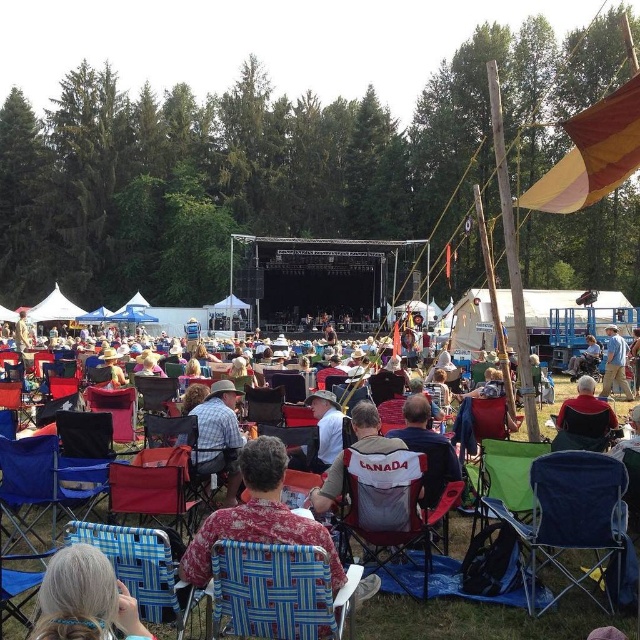
Based on the photo, does blue woven fabric chair at lower center come behind red fabric chair at center?

No, blue woven fabric chair at lower center is closer to the viewer.

Can you confirm if blue woven fabric chair at lower center is taller than red fabric chair at center?

No.

Between point (250, 552) and point (364, 621), which one is positioned behind?

The point (364, 621) is behind.

Identify the location of blue woven fabric chair at lower center. The height and width of the screenshot is (640, 640). (276, 592).

Does printed fabric shirt at center appear on the left side of matte black chair at center?

No, printed fabric shirt at center is not to the left of matte black chair at center.

Does printed fabric shirt at center appear over matte black chair at center?

Indeed, printed fabric shirt at center is positioned over matte black chair at center.

At what (x,y) coordinates should I click in order to perform the action: click on printed fabric shirt at center. Please return your answer as a coordinate pair (x, y). The width and height of the screenshot is (640, 640). Looking at the image, I should click on (257, 516).

Can you confirm if printed fabric shirt at center is bigger than dark blue fabric chair at center?

No.

Between point (314, 538) and point (593, 387), which one is positioned in front?

Point (314, 538)

I want to click on printed fabric shirt at center, so click(257, 516).